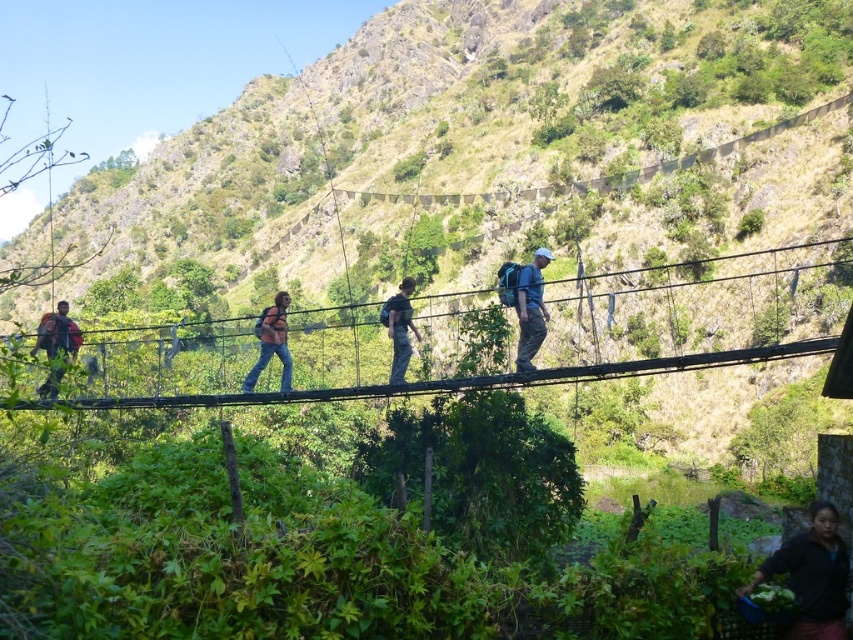
Is dark brown backpack at left to the left of dark blue jeans at center from the viewer's perspective?

Correct, you'll find dark brown backpack at left to the left of dark blue jeans at center.

Who is more distant from viewer, (x=77, y=324) or (x=399, y=364)?

Point (x=77, y=324)

Where is `dark brown backpack at left`? This screenshot has width=853, height=640. dark brown backpack at left is located at coordinates (57, 333).

Who is positioned more to the left, green grassy hillside at center or black wire rope bridge at center?

green grassy hillside at center

Looking at this image, is green grassy hillside at center to the right of black wire rope bridge at center from the viewer's perspective?

In fact, green grassy hillside at center is to the left of black wire rope bridge at center.

Is point (518, 44) closer to viewer compared to point (419, 388)?

No, (518, 44) is further to viewer.

This screenshot has height=640, width=853. Find the location of `green grassy hillside at center`. green grassy hillside at center is located at coordinates (454, 132).

Which is in front, point (839, 572) or point (519, 365)?

Point (839, 572)

Looking at this image, does dark blue fabric at lower right have a smaller size compared to blue fabric backpack at center?

Yes, dark blue fabric at lower right is smaller than blue fabric backpack at center.

Who is more distant from viewer, (792, 547) or (532, 355)?

The point (532, 355) is behind.

You are a GUI agent. You are given a task and a screenshot of the screen. Output one action in this format:
    pyautogui.click(x=<x>, y=<y>)
    Task: Click on the dark blue fabric at lower right
    
    Given the screenshot: What is the action you would take?
    pyautogui.click(x=811, y=576)